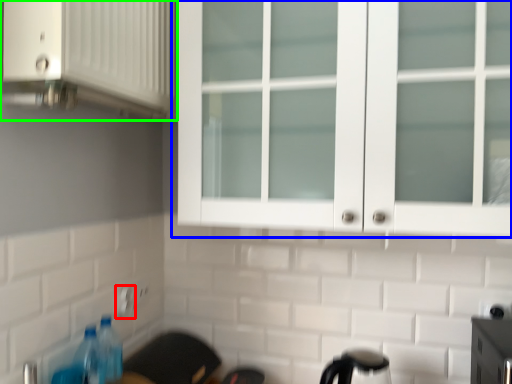
Question: Which object is positioned farthest from electric outlet (highlighted by a red box)? Select from cupboard (highlighted by a blue box) and cabinetry (highlighted by a green box).

Choices:
 (A) cupboard
 (B) cabinetry

Answer: (A)